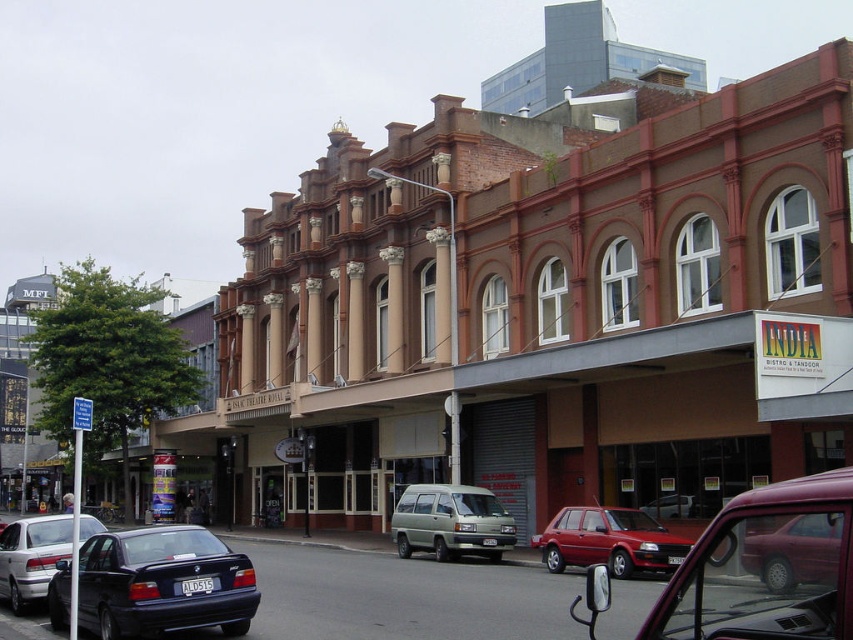
Question: Does shiny black sedan at lower left have a lesser width compared to metallic maroon sedan at center?

Choices:
 (A) no
 (B) yes

Answer: (B)

Question: Which point is farther from the camera taking this photo?

Choices:
 (A) (491, 512)
 (B) (828, 554)

Answer: (A)

Question: Which of these objects is positioned closest to the shiny black sedan at lower left?

Choices:
 (A) metallic red sedan at center
 (B) silver metallic sedan at lower left
 (C) metallic maroon sedan at center
 (D) light green matte van at center

Answer: (B)

Question: Which point is closer to the camera taking this photo?

Choices:
 (A) (549, 556)
 (B) (498, 529)

Answer: (A)

Question: Where is maroon metallic car at center located in relation to shiny black sedan at lower left in the image?

Choices:
 (A) left
 (B) right

Answer: (B)

Question: From the image, what is the correct spatial relationship of maroon metallic car at center in relation to metallic red sedan at center?

Choices:
 (A) above
 (B) below

Answer: (A)